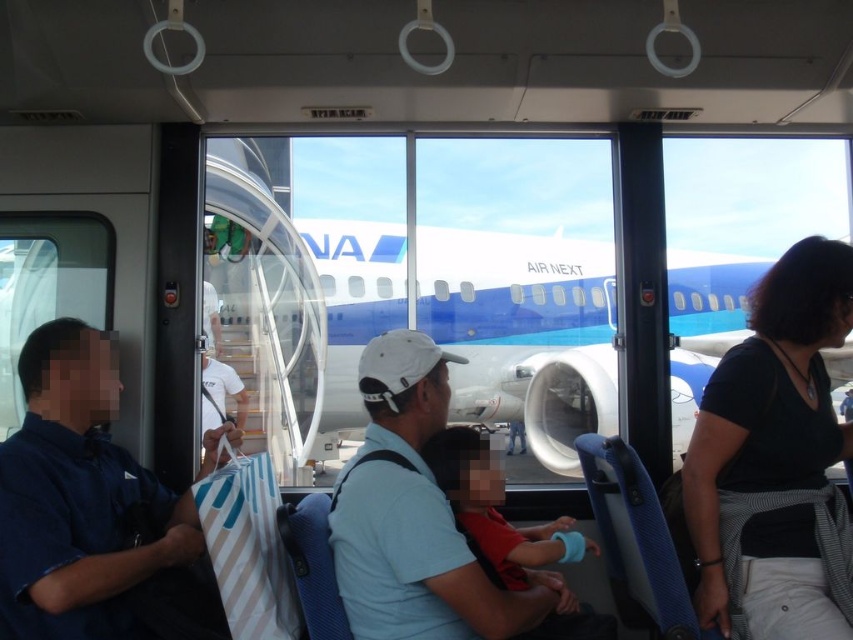
Does black fabric shirt at right have a lesser width compared to blue fabric bag at left?

Yes.

Consider the image. Which is above, black fabric shirt at right or blue fabric bag at left?

black fabric shirt at right is higher up.

Locate an element on the screen. This screenshot has width=853, height=640. black fabric shirt at right is located at coordinates (776, 461).

Find the location of a particular element. black fabric shirt at right is located at coordinates (776, 461).